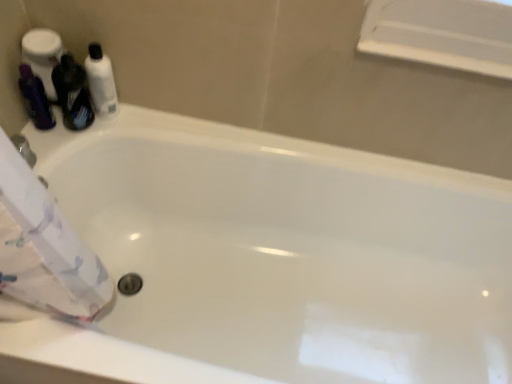
Question: From a real-world perspective, relative to matte purple shampoo at left, which appears as the second toiletry when viewed from the right, is white glossy bottle at upper left, which is the 2th toiletry from left to right, vertically above or below?

Choices:
 (A) below
 (B) above

Answer: (B)

Question: Does point (94, 86) appear closer or farther from the camera than point (35, 110)?

Choices:
 (A) closer
 (B) farther

Answer: (B)

Question: Which object is the closest to the white glossy bottle at upper left, which is the 2th toiletry from left to right?

Choices:
 (A) matte purple shampoo at left, which is the 1th toiletry in left-to-right order
 (B) matte black bottle at left

Answer: (B)

Question: Based on their relative distances, which object is nearer to the matte black bottle at left?

Choices:
 (A) matte purple shampoo at left, which is the 1th toiletry in left-to-right order
 (B) white glossy bottle at upper left, positioned as the first toiletry in right-to-left order

Answer: (B)